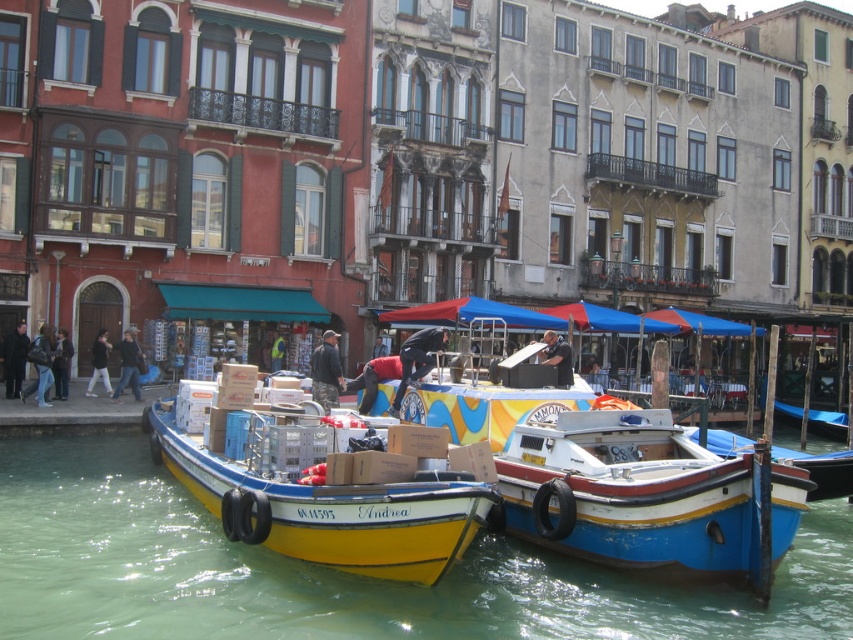
Question: Which of the following is the farthest from the observer?

Choices:
 (A) (258, 563)
 (B) (53, 369)
 (C) (38, 381)
 (D) (390, 406)

Answer: (B)

Question: In this image, where is dark gray jacket at left located relative to dark brown leather jacket at lower left?

Choices:
 (A) above
 (B) below

Answer: (B)

Question: Which object is closer to the camera taking this photo?

Choices:
 (A) reflective yellow jacket at center
 (B) camouflage jacket at center
 (C) yellow matte boat at center

Answer: (C)

Question: Which point is closer to the camera?

Choices:
 (A) yellow matte boat at center
 (B) black fabric jacket at center
 (C) dark blue jacket at left

Answer: (A)

Question: Can you confirm if jeans at lower left is positioned below dark brown leather jacket at lower left?

Choices:
 (A) no
 (B) yes

Answer: (A)

Question: Considering the relative positions of blue painted wood boat at right and dark blue jacket at left in the image provided, where is blue painted wood boat at right located with respect to dark blue jacket at left?

Choices:
 (A) left
 (B) right

Answer: (B)